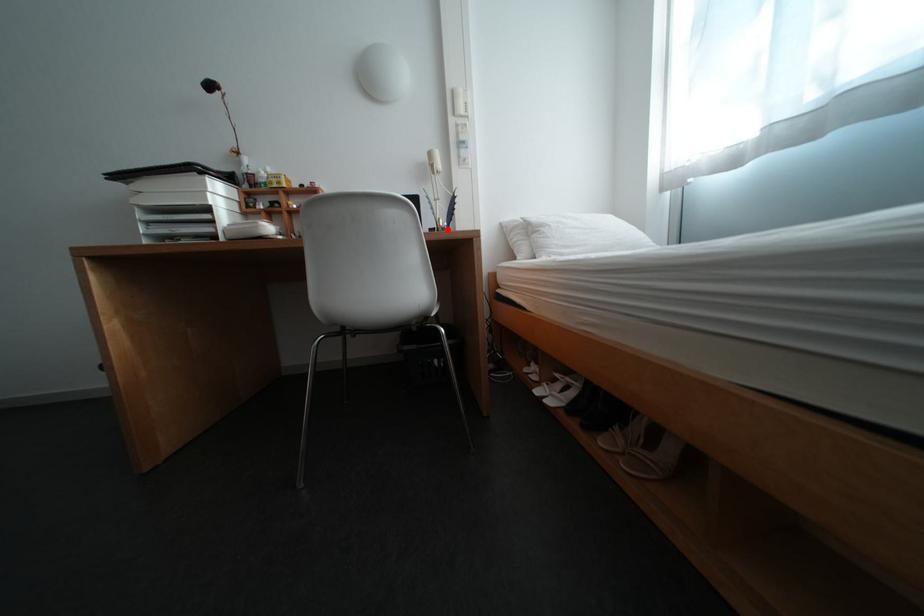
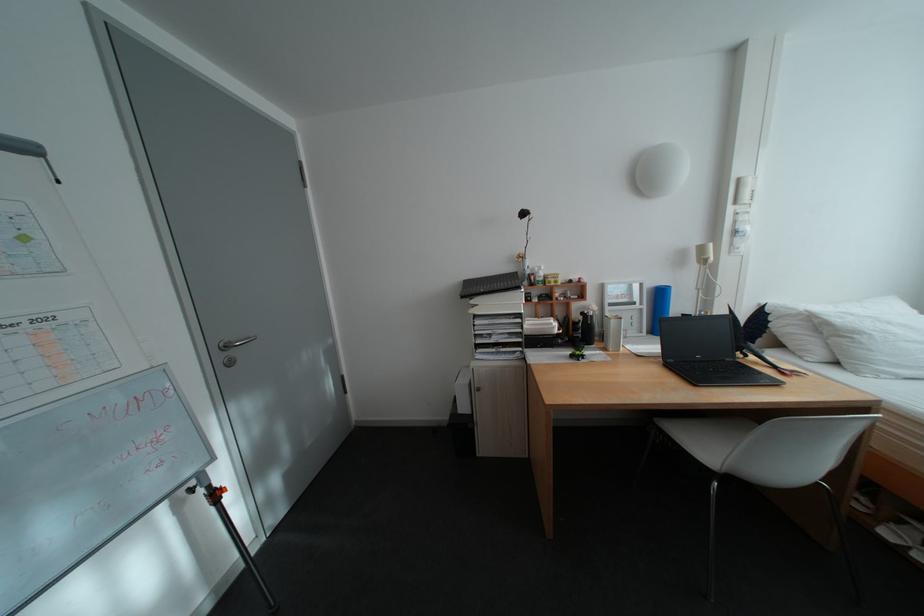
Question: I am providing you with two images of the same scene from different viewpoints. In image1, a red point is highlighted. Considering the same 3D point in image2, which of the following is correct?

Choices:
 (A) It is closer
 (B) It is farther

Answer: (B)